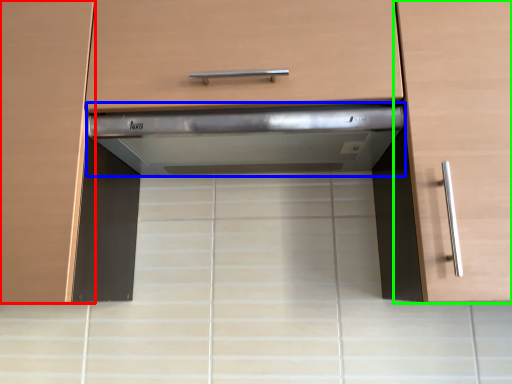
Question: Which object is positioned closest to cabinetry (highlighted by a red box)? Select from home appliance (highlighted by a blue box) and cabinetry (highlighted by a green box).

Choices:
 (A) home appliance
 (B) cabinetry

Answer: (A)